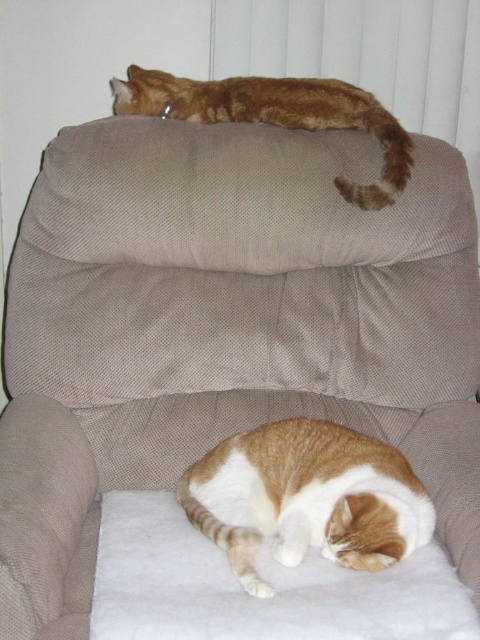
Question: Which of the following is the farthest from the observer?

Choices:
 (A) (168, 108)
 (B) (361, 490)

Answer: (A)

Question: From the image, what is the correct spatial relationship of orange-white fur cat at lower center in relation to orange fur cat at upper center?

Choices:
 (A) above
 (B) below

Answer: (B)

Question: Does orange-white fur cat at lower center come in front of orange fur cat at upper center?

Choices:
 (A) yes
 (B) no

Answer: (A)

Question: Can you confirm if orange-white fur cat at lower center is positioned to the right of orange fur cat at upper center?

Choices:
 (A) yes
 (B) no

Answer: (A)

Question: Which object appears closest to the camera in this image?

Choices:
 (A) orange-white fur cat at lower center
 (B) orange fur cat at upper center

Answer: (A)

Question: Which of the following is the closest to the observer?

Choices:
 (A) (262, 483)
 (B) (204, 93)

Answer: (A)